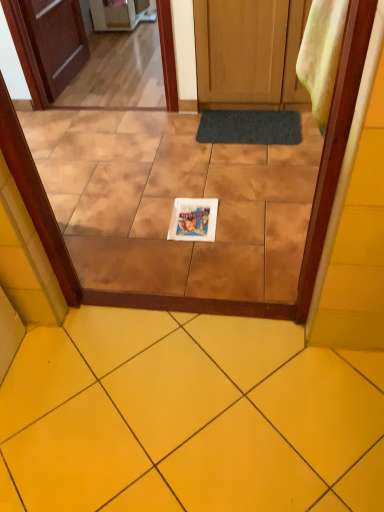
Question: From the image's perspective, is dark gray textured mat at center over yellow ceramic tile at center?

Choices:
 (A) no
 (B) yes

Answer: (B)

Question: Is dark gray textured mat at center looking in the opposite direction of yellow ceramic tile at center?

Choices:
 (A) no
 (B) yes

Answer: (A)

Question: From a real-world perspective, is dark gray textured mat at center located beneath yellow ceramic tile at center?

Choices:
 (A) no
 (B) yes

Answer: (B)

Question: Does dark gray textured mat at center have a greater width compared to yellow ceramic tile at center?

Choices:
 (A) no
 (B) yes

Answer: (A)

Question: Is the position of dark gray textured mat at center more distant than that of yellow ceramic tile at center?

Choices:
 (A) yes
 (B) no

Answer: (A)

Question: Can you confirm if dark gray textured mat at center is taller than yellow ceramic tile at center?

Choices:
 (A) yes
 (B) no

Answer: (B)

Question: Does yellow ceramic tile at center contain white glossy magazine at center?

Choices:
 (A) no
 (B) yes

Answer: (A)

Question: From a real-world perspective, is yellow ceramic tile at center physically below white glossy magazine at center?

Choices:
 (A) yes
 (B) no

Answer: (B)

Question: Is yellow ceramic tile at center taller than white glossy magazine at center?

Choices:
 (A) no
 (B) yes

Answer: (B)

Question: Is yellow ceramic tile at center positioned behind white glossy magazine at center?

Choices:
 (A) no
 (B) yes

Answer: (A)

Question: Can you confirm if yellow ceramic tile at center is positioned to the left of white glossy magazine at center?

Choices:
 (A) no
 (B) yes

Answer: (B)

Question: Is yellow ceramic tile at center oriented towards white glossy magazine at center?

Choices:
 (A) no
 (B) yes

Answer: (B)

Question: Does white glossy magazine at center contain yellow ceramic tile at center?

Choices:
 (A) yes
 (B) no

Answer: (B)